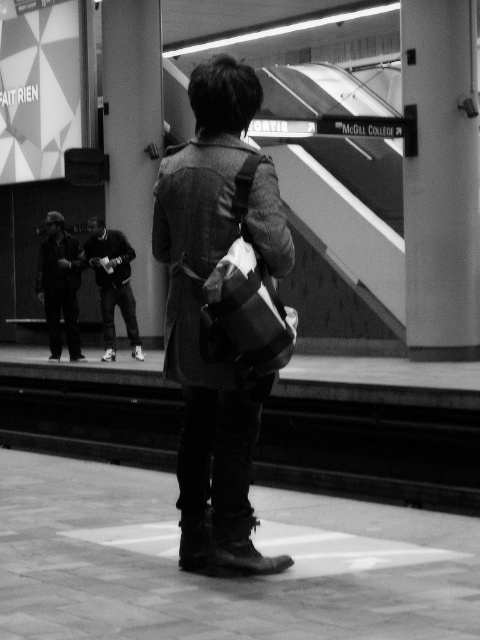
Question: Does dark fabric jacket at lower left have a lesser width compared to dark gray sweater at center?

Choices:
 (A) yes
 (B) no

Answer: (A)

Question: Which object appears closest to the camera in this image?

Choices:
 (A) dark gray sweater at center
 (B) denim jacket at center

Answer: (B)

Question: Does denim jacket at center appear on the left side of smooth concrete pillar at upper left?

Choices:
 (A) no
 (B) yes

Answer: (A)

Question: Which object is farther from the camera taking this photo?

Choices:
 (A) smooth concrete pillar at upper left
 (B) metallic gray pillar at upper right
 (C) denim jacket at center

Answer: (A)

Question: Is denim jacket at center in front of smooth concrete pillar at upper left?

Choices:
 (A) no
 (B) yes

Answer: (B)

Question: Which point appears farthest from the camera in this image?

Choices:
 (A) (192, 387)
 (B) (111, 317)
 (C) (147, 324)

Answer: (C)